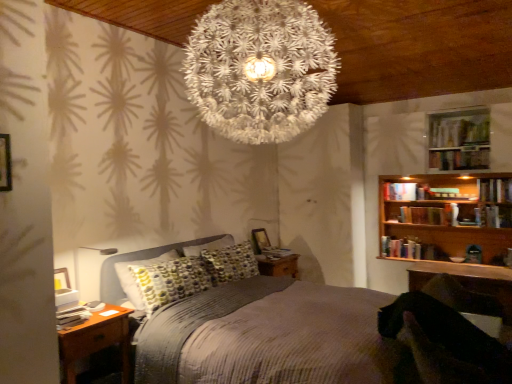
Image resolution: width=512 pixels, height=384 pixels. What are the coordinates of `free space above hardcover book at upper right, the 5th book when ordered from left to right (from a real-world perspective)` in the screenshot? It's located at (457, 153).